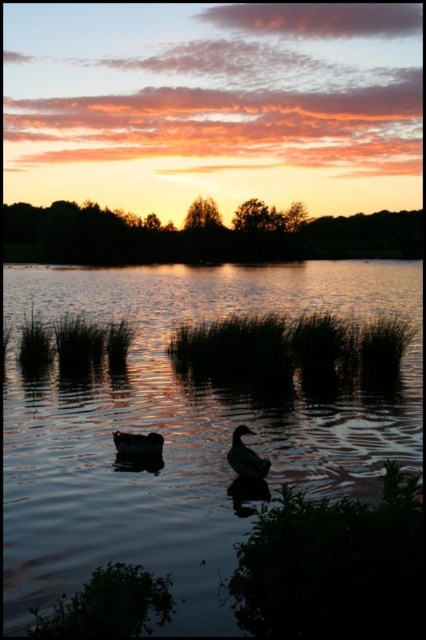
Question: Can you confirm if green grass at center is positioned below silvery glossy duck at center?

Choices:
 (A) no
 (B) yes

Answer: (A)

Question: Which object is farther from the camera taking this photo?

Choices:
 (A) smooth water at center
 (B) green grass at center

Answer: (B)

Question: Based on their relative distances, which object is nearer to the dark matte duck at center?

Choices:
 (A) smooth water at center
 (B) silvery glossy duck at center
 (C) green grass at center

Answer: (B)

Question: Can you confirm if green grass at center is wider than dark matte duck at center?

Choices:
 (A) yes
 (B) no

Answer: (B)

Question: Which object is farther from the camera taking this photo?

Choices:
 (A) silvery glossy duck at center
 (B) green grass at center

Answer: (B)

Question: Is green grass at center bigger than silvery glossy duck at center?

Choices:
 (A) yes
 (B) no

Answer: (B)